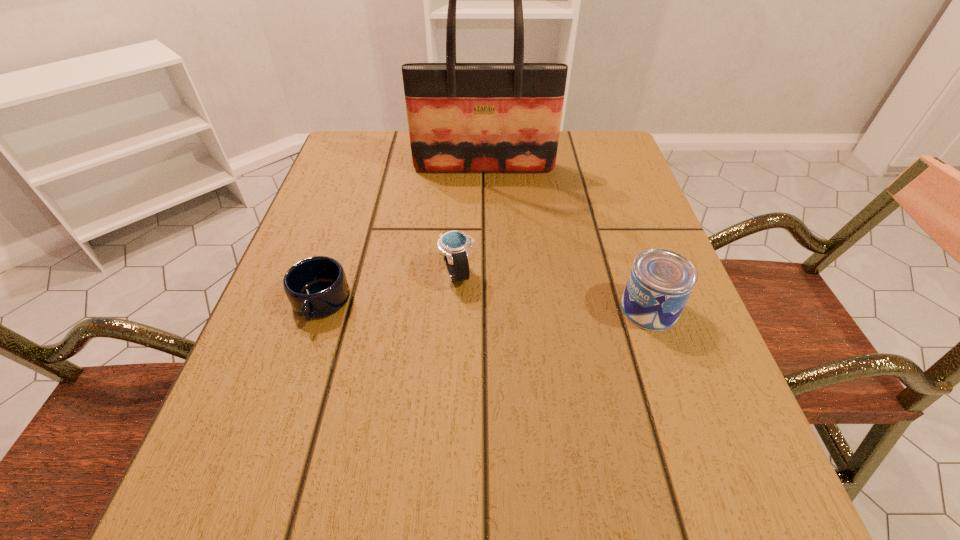
What are the coordinates of `blank space located on the front of the watch` in the screenshot? It's located at (454, 339).

Where is `blank area located with the handle on the side of the mug`? This screenshot has width=960, height=540. blank area located with the handle on the side of the mug is located at coordinates (292, 390).

In order to click on object present at the far edge in this screenshot , I will do `click(462, 117)`.

The width and height of the screenshot is (960, 540). In order to click on object positioned at the left edge in this screenshot , I will do `click(316, 287)`.

Locate an element on the screen. This screenshot has height=540, width=960. object present at the right edge is located at coordinates [x=661, y=281].

This screenshot has width=960, height=540. I want to click on vacant space at the left edge of the desktop, so click(303, 250).

Image resolution: width=960 pixels, height=540 pixels. Find the location of `blank area at the right edge`. blank area at the right edge is located at coordinates (612, 203).

Identify the location of vacant space at the far left corner. (381, 175).

Find the location of `vacant space at the near left corner of the desktop`. vacant space at the near left corner of the desktop is located at coordinates (195, 512).

You are a GUI agent. You are given a task and a screenshot of the screen. Output one action in this format:
    pyautogui.click(x=<x>, y=<y>)
    Task: Click on the empty space between the can and the shopping bag
    The width and height of the screenshot is (960, 540).
    Given the screenshot: What is the action you would take?
    pyautogui.click(x=566, y=238)